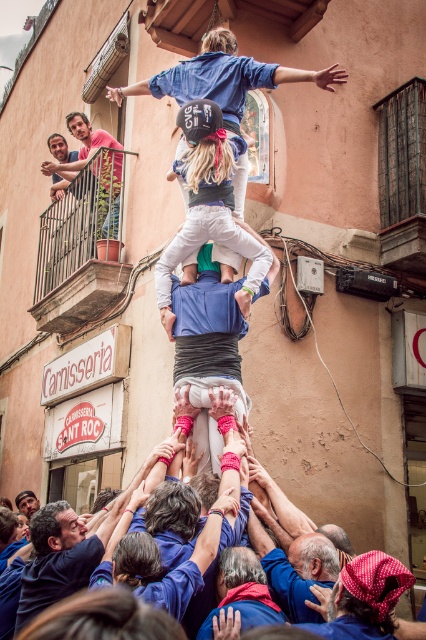
You are a photographer trying to capture the human tower. You notice the light blue denim pants at center and the blue fabric shirt at center. Which clothing item would appear bigger in your photo?

The light blue denim pants at center would appear bigger in the photo since they have a larger size compared to the blue fabric shirt at center.

Consider the image. You are a photographer standing at the base of the castells tower. You want to take a photo that includes both the castells tower and the pinkish orange textured wall in the background. You have two points marked on your viewfinder at coordinates point [268,486] and point [80,120]. Which point is closer to you, the photographer?

Point [268,486] is in front of point [80,120], so the photographer is closer to point [268,486].